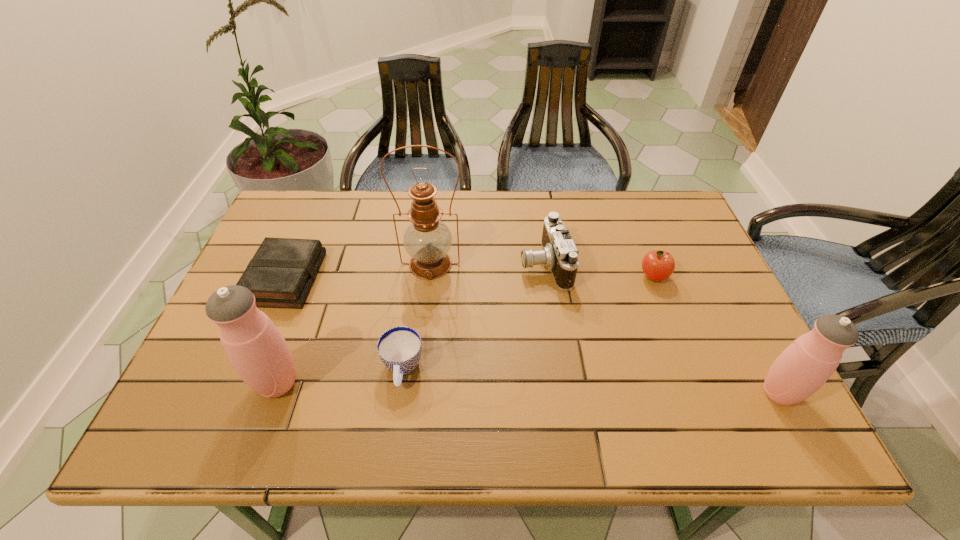
In order to click on thermos bottle that is at the right edge in this screenshot , I will do `click(807, 363)`.

Identify the location of apple that is at the right edge. Image resolution: width=960 pixels, height=540 pixels. (658, 265).

This screenshot has width=960, height=540. I want to click on object positioned at the near left corner, so click(x=256, y=349).

At what (x,y) coordinates should I click in order to perform the action: click on object that is at the near right corner. Please return your answer as a coordinate pair (x, y). This screenshot has width=960, height=540. Looking at the image, I should click on (807, 363).

This screenshot has height=540, width=960. I want to click on vacant space at the far edge of the desktop, so (x=614, y=190).

At what (x,y) coordinates should I click in order to perform the action: click on free location at the near edge. Please return your answer as a coordinate pair (x, y). Image resolution: width=960 pixels, height=540 pixels. Looking at the image, I should click on (371, 380).

Locate an element on the screen. Image resolution: width=960 pixels, height=540 pixels. blank area at the right edge is located at coordinates [678, 275].

In the image, there is a desktop. Identify the location of vacant space at the far left corner. (310, 226).

The image size is (960, 540). In the image, there is a desktop. Find the location of `vacant area at the far right corner`. vacant area at the far right corner is located at coordinates (624, 194).

Locate an element on the screen. free space that is in between the right thermos bottle and the shortest object is located at coordinates (533, 336).